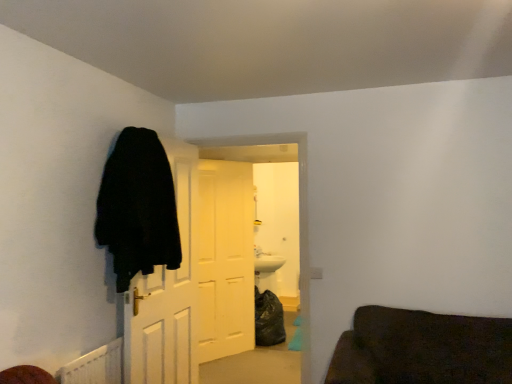
Question: Considering the relative sizes of white matte door at center, marked as the 3th door in a front-to-back arrangement, and black matte door at left, the third door positioned from the back, in the image provided, is white matte door at center, marked as the 3th door in a front-to-back arrangement, taller than black matte door at left, the third door positioned from the back,?

Choices:
 (A) no
 (B) yes

Answer: (B)

Question: Is white matte door at center, acting as the 1th door starting from the back, oriented towards black matte door at left, the 1th door in the front-to-back sequence?

Choices:
 (A) yes
 (B) no

Answer: (B)

Question: Can you confirm if white matte door at center, marked as the 3th door in a front-to-back arrangement, is bigger than black matte door at left, the 1th door in the front-to-back sequence?

Choices:
 (A) yes
 (B) no

Answer: (B)

Question: Is black matte door at left, the 1th door in the front-to-back sequence, a part of white matte door at center, marked as the 3th door in a front-to-back arrangement?

Choices:
 (A) yes
 (B) no

Answer: (B)

Question: From a real-world perspective, is white matte door at center, marked as the 3th door in a front-to-back arrangement, positioned under black matte door at left, the 1th door in the front-to-back sequence, based on gravity?

Choices:
 (A) no
 (B) yes

Answer: (B)

Question: From a real-world perspective, is black fuzzy coat at left physically located above or below white matte door at center, marked as the 3th door in a front-to-back arrangement?

Choices:
 (A) below
 (B) above

Answer: (B)

Question: From the image's perspective, relative to white matte door at center, acting as the 1th door starting from the back, is black fuzzy coat at left above or below?

Choices:
 (A) above
 (B) below

Answer: (A)

Question: From their relative heights in the image, would you say black fuzzy coat at left is taller or shorter than white matte door at center, acting as the 1th door starting from the back?

Choices:
 (A) tall
 (B) short

Answer: (B)

Question: Considering their positions, is black fuzzy coat at left located in front of or behind white matte door at center, marked as the 3th door in a front-to-back arrangement?

Choices:
 (A) behind
 (B) front

Answer: (B)

Question: From a real-world perspective, relative to black matte door at left, the third door positioned from the back, is black fuzzy coat at left vertically above or below?

Choices:
 (A) above
 (B) below

Answer: (A)

Question: Considering the relative positions of black fuzzy coat at left and black matte door at left, the third door positioned from the back, in the image provided, is black fuzzy coat at left to the left or to the right of black matte door at left, the third door positioned from the back,?

Choices:
 (A) left
 (B) right

Answer: (A)

Question: Would you say black fuzzy coat at left is inside or outside black matte door at left, the 1th door in the front-to-back sequence?

Choices:
 (A) inside
 (B) outside

Answer: (B)

Question: Considering their positions, is black fuzzy coat at left located in front of or behind black matte door at left, the 1th door in the front-to-back sequence?

Choices:
 (A) front
 (B) behind

Answer: (A)

Question: Considering the relative positions of black fuzzy coat at left and white wooden door at center, which is the second door from back to front, in the image provided, is black fuzzy coat at left to the left or to the right of white wooden door at center, which is the second door from back to front,?

Choices:
 (A) left
 (B) right

Answer: (A)

Question: Does point (116, 178) appear closer or farther from the camera than point (157, 317)?

Choices:
 (A) farther
 (B) closer

Answer: (B)